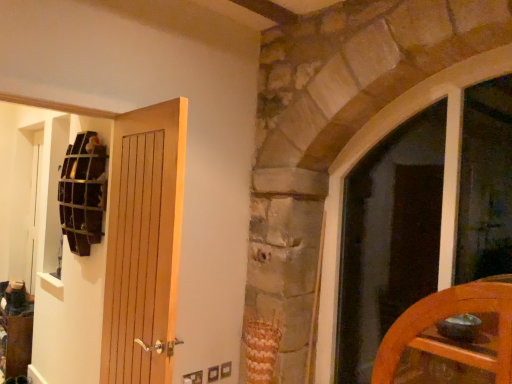
Question: Based on their positions, is wooden grid at upper left located to the left or right of wooden door at left, placed as the 2th door when sorted from right to left?

Choices:
 (A) right
 (B) left

Answer: (B)

Question: Is wooden grid at upper left taller or shorter than wooden door at left, positioned as the first door in left-to-right order?

Choices:
 (A) tall
 (B) short

Answer: (B)

Question: Estimate the real-world distances between objects in this image. Which object is farther from the wooden grid at upper left?

Choices:
 (A) wooden door at left, placed as the 2th door when sorted from right to left
 (B) wooden at left, which is the second door from left to right
 (C) matte glass window at right

Answer: (C)

Question: Which object is the farthest from the wooden door at left, placed as the 2th door when sorted from right to left?

Choices:
 (A) wooden grid at upper left
 (B) wooden at left, the first door viewed from the right
 (C) matte glass window at right

Answer: (C)